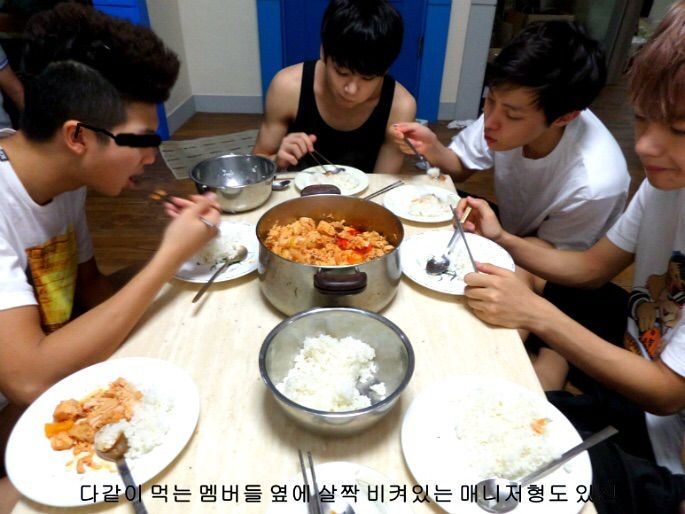
Identify the location of blue door. (416, 64), (134, 11).